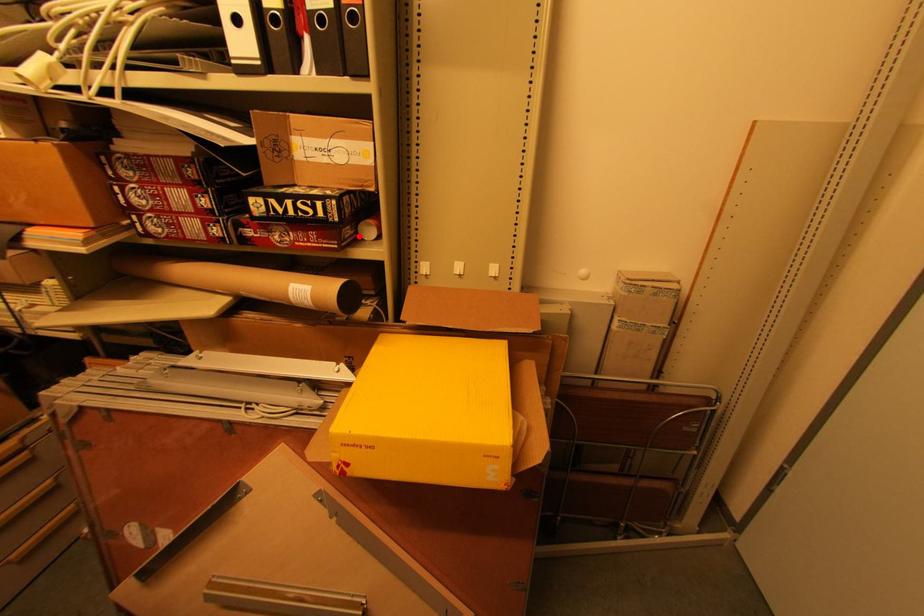
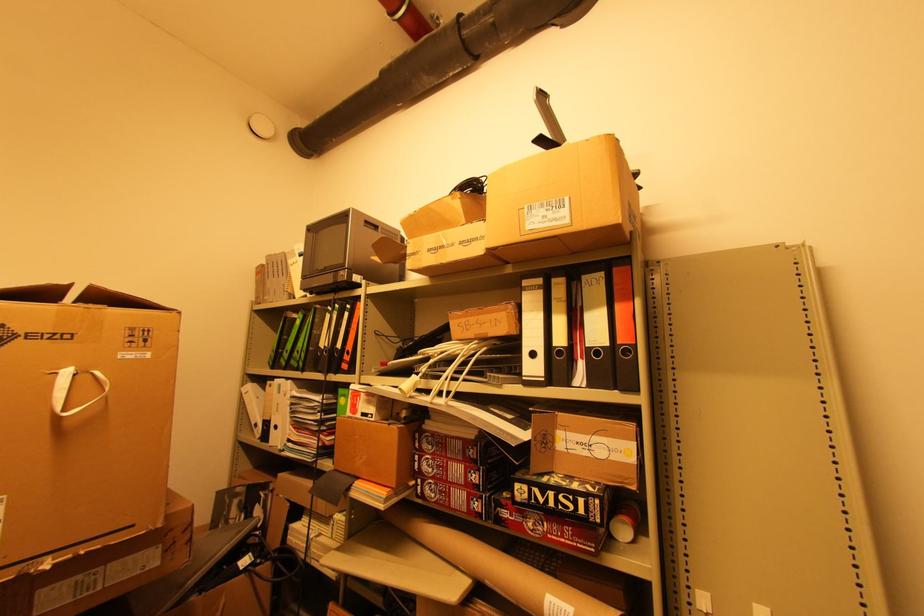
Find the pixel in the second image that matches the highlighted location in the first image.

(611, 535)